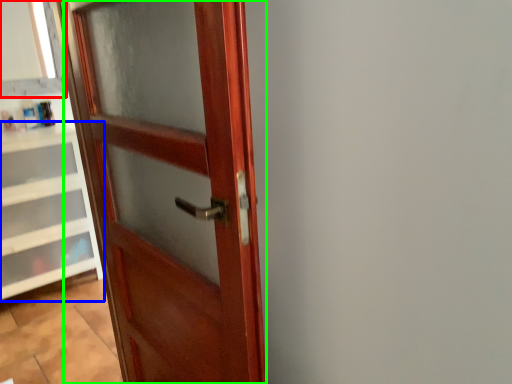
Question: Considering the real-world distances, which object is closest to window frame (highlighted by a red box)? cabinetry (highlighted by a blue box) or door (highlighted by a green box).

Choices:
 (A) cabinetry
 (B) door

Answer: (A)